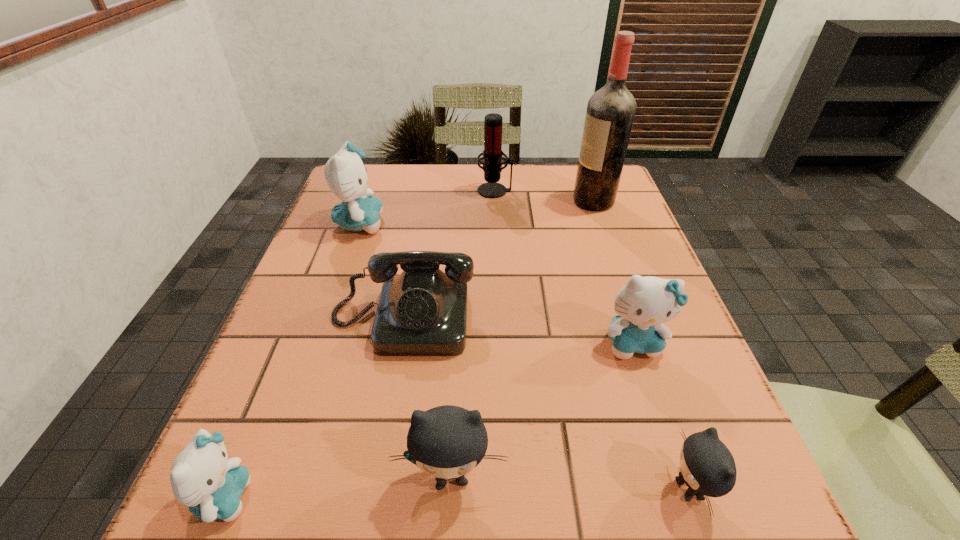
At what (x,y) coordinates should I click in order to perform the action: click on object situated at the near right corner. Please return your answer as a coordinate pair (x, y). This screenshot has width=960, height=540. Looking at the image, I should click on (707, 467).

The height and width of the screenshot is (540, 960). In the image, there is a desktop. Find the location of `vacant space at the far edge`. vacant space at the far edge is located at coordinates (444, 192).

You are a GUI agent. You are given a task and a screenshot of the screen. Output one action in this format:
    pyautogui.click(x=<x>, y=<y>)
    Task: Click on the vacant space at the near edge of the desktop
    The image size is (960, 540).
    Given the screenshot: What is the action you would take?
    pyautogui.click(x=646, y=528)

Locate an element on the screen. vacant space at the left edge of the desktop is located at coordinates (352, 345).

The width and height of the screenshot is (960, 540). In order to click on free space at the right edge of the desktop in this screenshot , I will do click(648, 241).

The image size is (960, 540). I want to click on free space at the far left corner of the desktop, so click(398, 172).

You are a GUI agent. You are given a task and a screenshot of the screen. Output one action in this format:
    pyautogui.click(x=<x>, y=<y>)
    Task: Click on the vacant space at the near left corner of the desktop
    Image resolution: width=960 pixels, height=540 pixels.
    Given the screenshot: What is the action you would take?
    pyautogui.click(x=257, y=497)

Where is `vacant point at the far right corner`? The image size is (960, 540). vacant point at the far right corner is located at coordinates (571, 201).

Where is `free spot between the red microphone and the smaller gray kitten`? free spot between the red microphone and the smaller gray kitten is located at coordinates (592, 340).

Find the location of a particular element. The image size is (960, 540). free point between the left gray kitten and the smaller gray kitten is located at coordinates (570, 482).